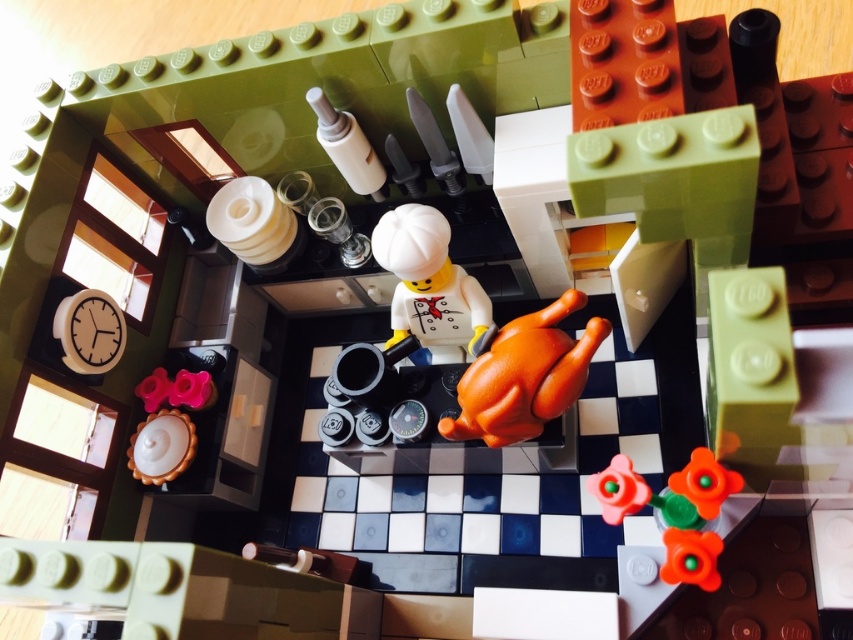
You are a LEGO figure trying to balance the orange matte chicken at center and the white matte chef hat at center on your head. Which object will require more space on your head?

The white matte chef hat at center is larger than the orange matte chicken at center, so it will require more space on your head.

You are a LEGO figure standing at the entrance of the kitchen scene. You want to grab the orange matte flower at lower right but need to avoid bumping into the white matte chef hat at center. Which object should you move closer to first?

The white matte chef hat at center is closer to you than the orange matte flower at lower right, so you should move closer to the white matte chef hat at center first to avoid bumping into it before reaching the orange matte flower at lower right.

In the LEGO kitchen scene, there is a LEGO chef wearing a white matte chef hat at center and holding a large orange turkey. Where is the white matte chef hat at center located in relation to the point with coordinates (428, 284)?

The point with coordinates (428, 284) corresponds to the white matte chef hat at center, so it is located exactly at that point.